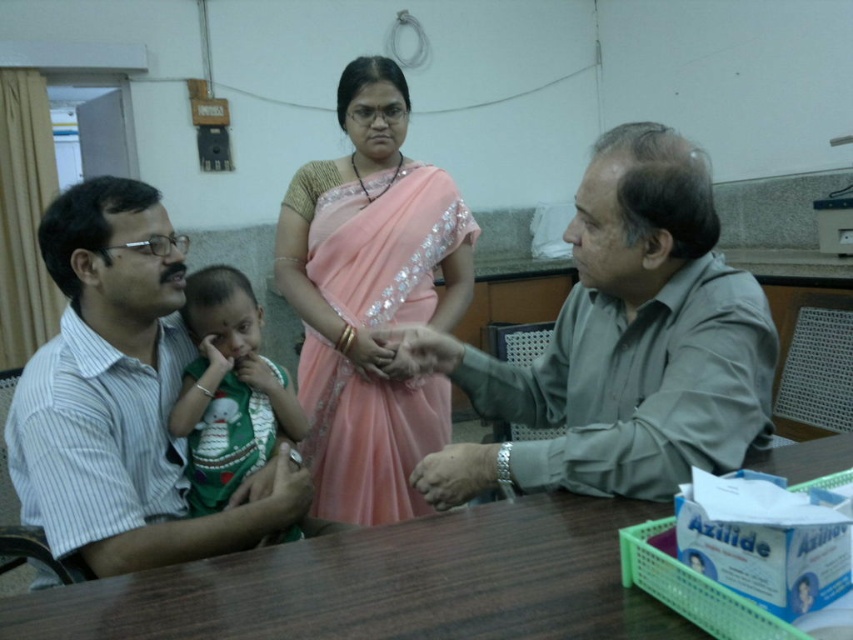
Question: Which point is closer to the camera taking this photo?

Choices:
 (A) (369, 275)
 (B) (129, 272)
 (C) (672, 285)
 (D) (20, 612)

Answer: (D)

Question: Considering the relative positions of wooden table at center and green knitted sweater at left in the image provided, where is wooden table at center located with respect to green knitted sweater at left?

Choices:
 (A) below
 (B) above

Answer: (A)

Question: Which object is farther from the camera taking this photo?

Choices:
 (A) wooden table at center
 (B) green knitted sweater at left
 (C) pink satin saree at center
 (D) white striped shirt at left

Answer: (C)

Question: Where is gray matte shirt at center located in relation to wooden table at center in the image?

Choices:
 (A) below
 (B) above

Answer: (B)

Question: Which point is farther to the camera?

Choices:
 (A) white striped shirt at left
 (B) gray matte shirt at center

Answer: (A)

Question: Does pink satin saree at center lie behind green knitted sweater at left?

Choices:
 (A) no
 (B) yes

Answer: (B)